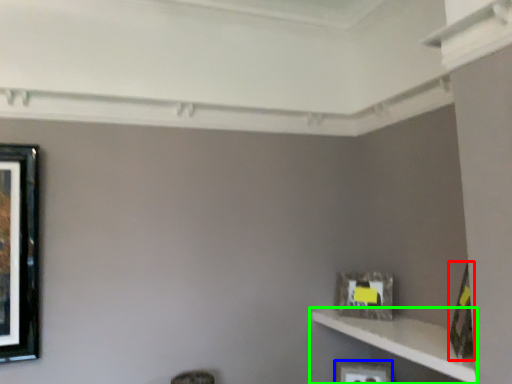
Question: Based on their relative distances, which object is farther from picture frame (highlighted by a red box)? Choose from picture frame (highlighted by a blue box) and shelf (highlighted by a green box).

Choices:
 (A) picture frame
 (B) shelf

Answer: (A)